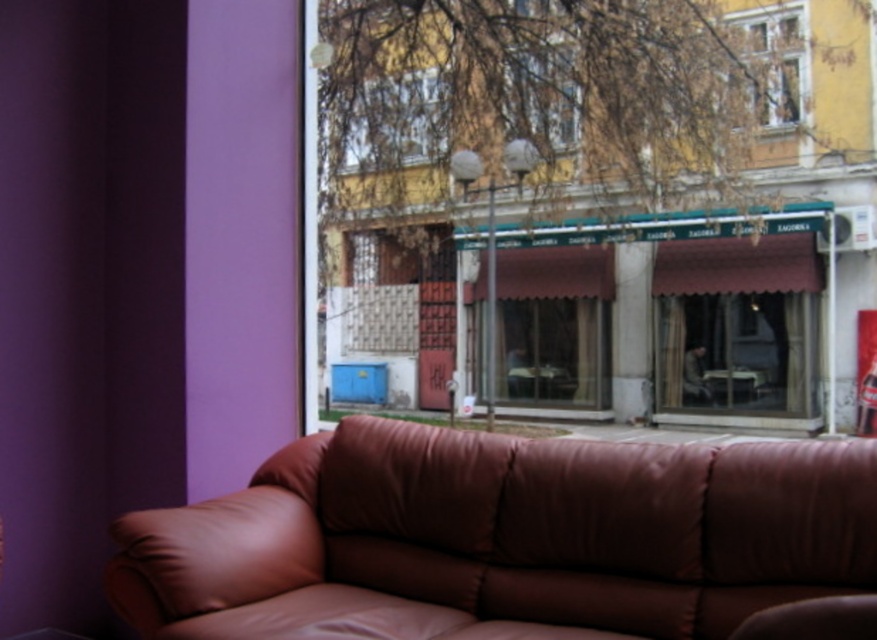
Question: Which is nearer to the wooden window frame at upper right?

Choices:
 (A) transparent glass window at upper center
 (B) transparent glass window at center
 (C) leather couch at lower center

Answer: (B)

Question: Among these objects, which one is nearest to the camera?

Choices:
 (A) transparent glass window at center
 (B) transparent glass window at upper center
 (C) leather couch at lower center

Answer: (C)

Question: Considering the relative positions of leather couch at lower center and transparent glass window at center in the image provided, where is leather couch at lower center located with respect to transparent glass window at center?

Choices:
 (A) left
 (B) right

Answer: (A)

Question: Observing the image, what is the correct spatial positioning of leather couch at lower center in reference to transparent glass window at center?

Choices:
 (A) above
 (B) below

Answer: (B)

Question: Which point appears farthest from the camera in this image?

Choices:
 (A) (353, 120)
 (B) (564, 84)
 (C) (241, 573)

Answer: (B)

Question: Is transparent glass window at upper center above transparent glass window at center?

Choices:
 (A) yes
 (B) no

Answer: (B)